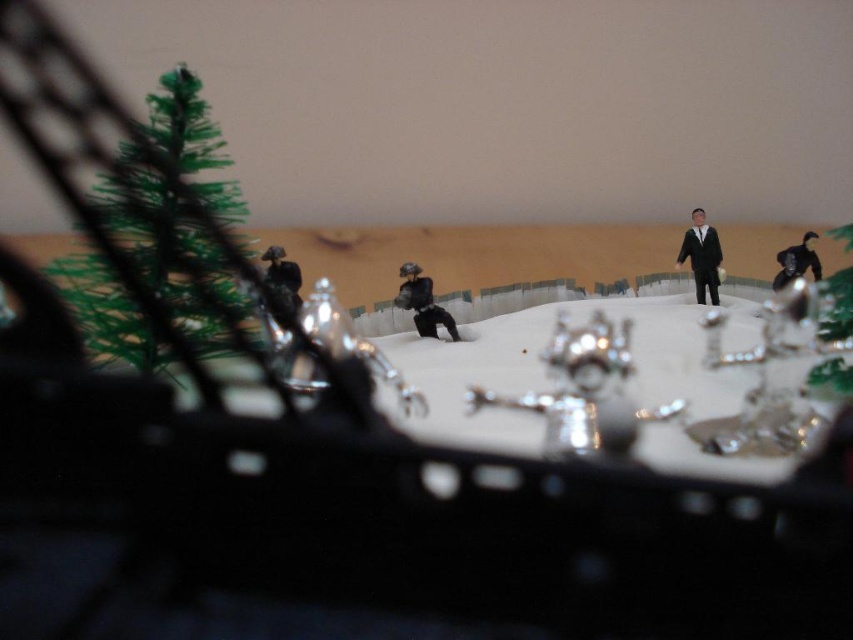
Question: Which point is closer to the camera taking this photo?

Choices:
 (A) (694, 268)
 (B) (428, 312)

Answer: (B)

Question: Estimate the real-world distances between objects in this image. Which object is closer to the black matte suit at center?

Choices:
 (A) shiny silver ornament at center
 (B) black matte gorilla at upper right
 (C) matte black figure at center

Answer: (B)

Question: Can you confirm if matte black figure at center is positioned to the right of black matte gorilla at upper right?

Choices:
 (A) yes
 (B) no

Answer: (B)

Question: Is shiny silver ornament at center wider than black matte gorilla at upper right?

Choices:
 (A) no
 (B) yes

Answer: (B)

Question: Is shiny silver ornament at center positioned behind matte black figure at center?

Choices:
 (A) no
 (B) yes

Answer: (A)

Question: Which of these objects is positioned closest to the black matte suit at center?

Choices:
 (A) shiny silver ornament at center
 (B) matte black figure at center

Answer: (B)